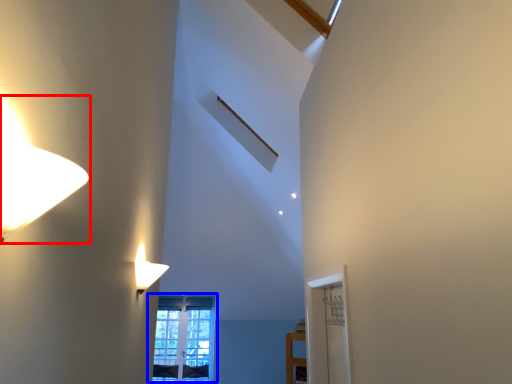
Question: Which object appears closest to the camera in this image, lamp (highlighted by a red box) or window (highlighted by a blue box)?

Choices:
 (A) lamp
 (B) window

Answer: (A)